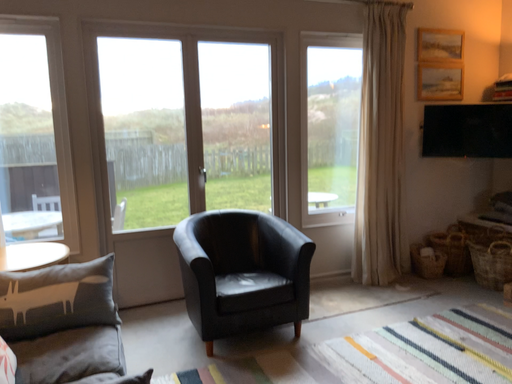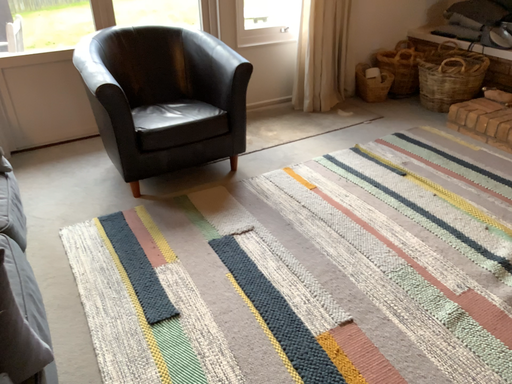
Question: How did the camera likely rotate when shooting the video?

Choices:
 (A) rotated right
 (B) rotated left

Answer: (A)